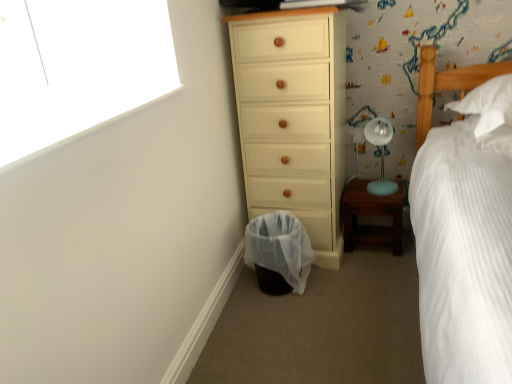
The height and width of the screenshot is (384, 512). Identify the location of free location to the right of translucent plastic laundry basket at lower center. click(345, 281).